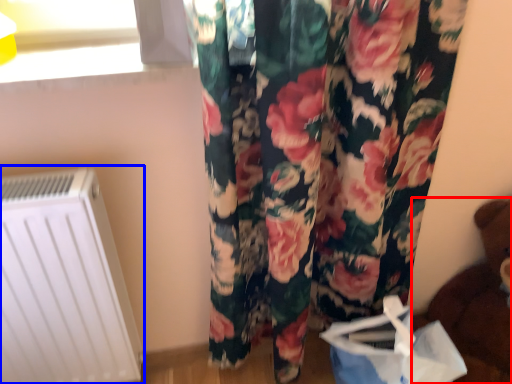
Question: Which object is closer to the camera taking this photo, toy (highlighted by a red box) or radiator (highlighted by a blue box)?

Choices:
 (A) toy
 (B) radiator

Answer: (A)